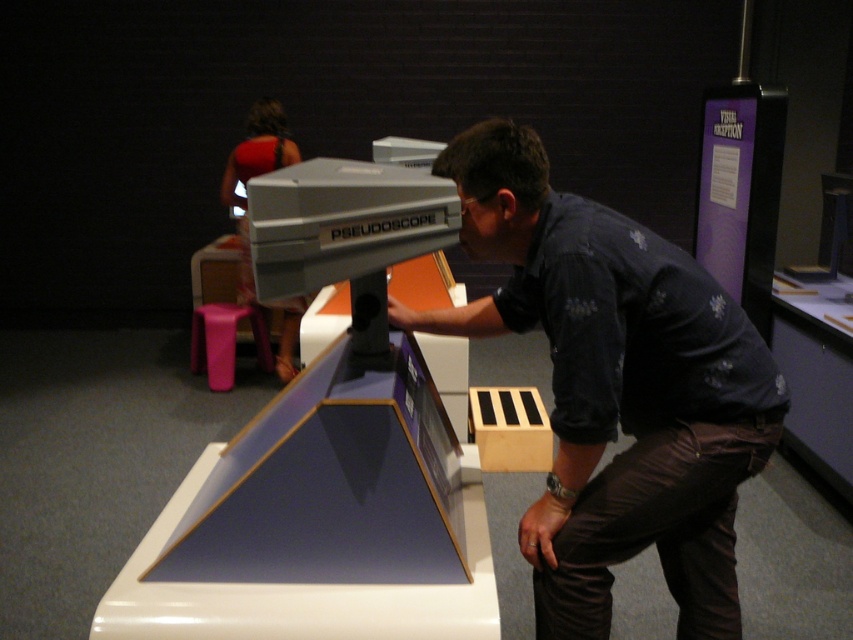
You are a security guard in the exhibit. Your task is to ensure that visitors maintain a minimum distance of 4 feet from the PSEUDOSCOPE to prevent accidental damage. You notice the dark blue shirt at center. Can you determine if they are within the safety zone?

The dark blue shirt at center is only 3.99 feet away from the camera, which is just below the required 4 feet minimum distance. Therefore, they are within the safety zone and need to step back to comply with the 4 feet rule.

Looking at this image, you are an event planner setting up an exhibit. You need to ensure that the dark blue shirt at center and the purple plastic stool at lower left are arranged so that the wider object is placed on the left side for better visual balance. Which object should be placed on the left?

The dark blue shirt at center is wider than the purple plastic stool at lower left, so it should be placed on the left side for better visual balance.